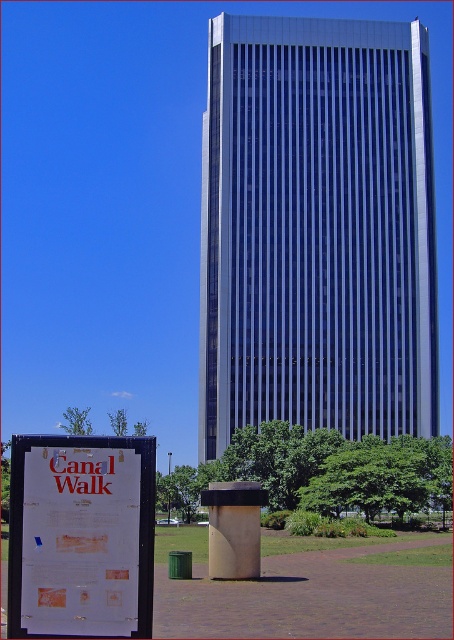
Question: Is white paper sign at lower left above green leafy tree at lower left?

Choices:
 (A) no
 (B) yes

Answer: (B)

Question: Can you confirm if white paper sign at lower left is bigger than green leafy tree at lower left?

Choices:
 (A) yes
 (B) no

Answer: (B)

Question: Estimate the real-world distances between objects in this image. Which object is farther from the green leafy tree at lower left?

Choices:
 (A) silver glass skyscraper at center
 (B) white paper sign at lower left

Answer: (B)

Question: Does white paper sign at lower left have a larger size compared to green leafy tree at lower left?

Choices:
 (A) yes
 (B) no

Answer: (B)

Question: Which point appears farthest from the camera in this image?

Choices:
 (A) (60, 420)
 (B) (148, 476)

Answer: (A)

Question: Considering the real-world distances, which object is closest to the green leafy tree at lower left?

Choices:
 (A) silver glass skyscraper at center
 (B) white paper sign at lower left

Answer: (A)